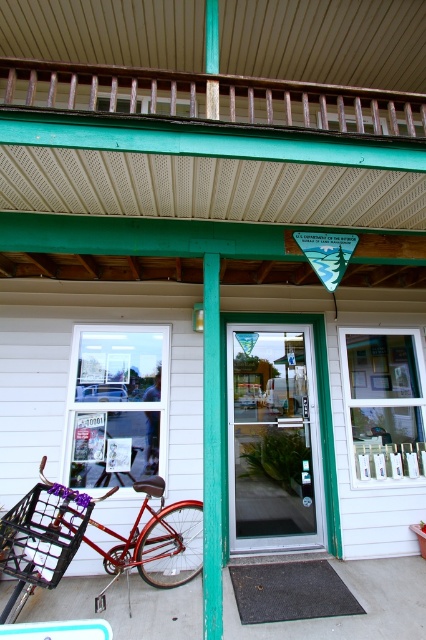
You are a delivery person approaching the entrance of the building. You need to park your shiny red bicycle at lower left and secure it to the teal painted wood post at center. Based on the scene, can you determine if the bicycle is already positioned to the left of the post?

Yes, the shiny red bicycle at lower left is already positioned to the left of the teal painted wood post at center, so it is correctly placed for securing.

You are a delivery person carrying a large package that requires a 2 meter clearance to pass through. You need to navigate between the rusty wood rail at upper center and the teal painted wood post at center. Can you safely pass through this space with your package?

The rusty wood rail at upper center and teal painted wood post at center are 1.95 meters apart, which is slightly less than the required 2 meter clearance. Therefore, you cannot safely pass through this space with your package.

You are a delivery person trying to enter the building through the clear glass door at center. You have a large box that is 1.5 meters wide. Can the box fit through the door? Please consider the width of the teal painted wood post at center for comparison.

The clear glass door at center is wider than the teal painted wood post at center. Since the box is 1.5 meters wide, if the teal painted wood post at center is narrower than 1.5 meters, the door might be wider and could accommodate the box. However, without exact measurements, it is uncertain. Please check the actual dimensions.